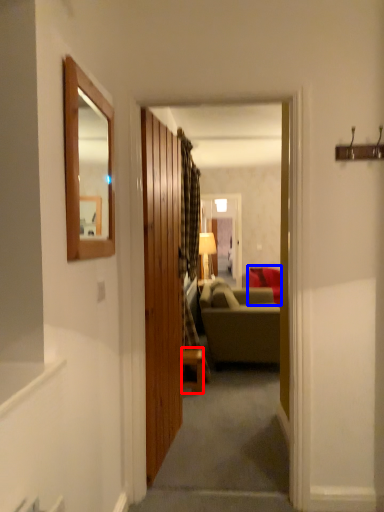
Question: Among these objects, which one is farthest to the camera, table (highlighted by a red box) or studio couch (highlighted by a blue box)?

Choices:
 (A) table
 (B) studio couch

Answer: (B)